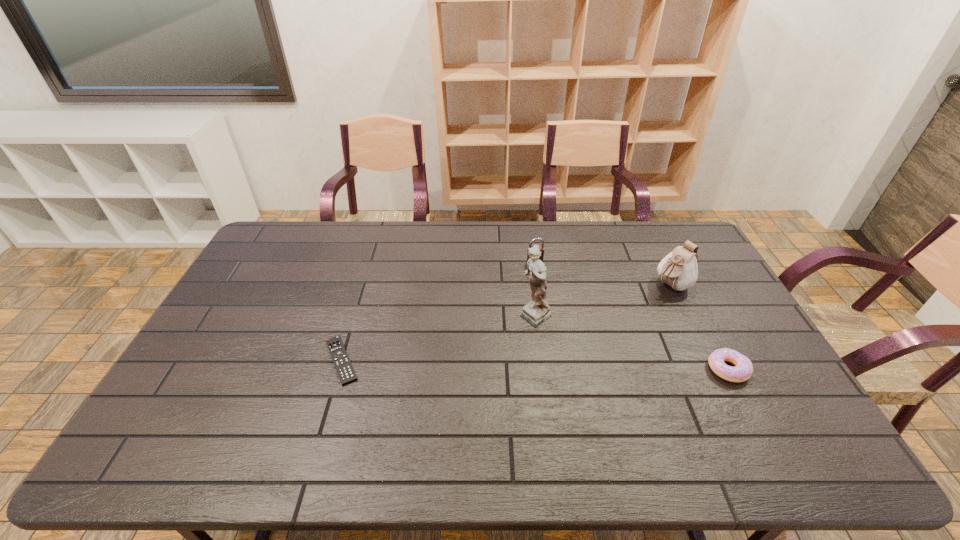
Find the location of a particular element. Image resolution: width=960 pixels, height=540 pixels. doughnut located in the right edge section of the desktop is located at coordinates (743, 369).

Find the location of a particular element. This screenshot has width=960, height=540. pouch situated at the right edge is located at coordinates (679, 269).

I want to click on free space at the far edge of the desktop, so click(643, 231).

Where is `vacant area at the near edge`? Image resolution: width=960 pixels, height=540 pixels. vacant area at the near edge is located at coordinates (707, 416).

Identify the location of vacant space at the right edge of the desktop. The width and height of the screenshot is (960, 540). (706, 293).

At what (x,y) coordinates should I click in order to perform the action: click on free space at the far left corner. Please return your answer as a coordinate pair (x, y). The width and height of the screenshot is (960, 540). Looking at the image, I should click on (269, 233).

In the image, there is a desktop. At what (x,y) coordinates should I click in order to perform the action: click on vacant area at the far right corner. Please return your answer as a coordinate pair (x, y). The image size is (960, 540). Looking at the image, I should click on pos(661,254).

Locate an element on the screen. The image size is (960, 540). free spot between the shortest object and the doughnut is located at coordinates (535, 364).

You are a GUI agent. You are given a task and a screenshot of the screen. Output one action in this format:
    pyautogui.click(x=<x>, y=<y>)
    Task: Click on the free space between the doughnut and the tallest object
    The image size is (960, 540).
    Given the screenshot: What is the action you would take?
    tap(632, 343)

At what (x,y) coordinates should I click in order to perform the action: click on unoccupied area between the pouch and the remote control. Please return your answer as a coordinate pair (x, y). Looking at the image, I should click on (506, 322).